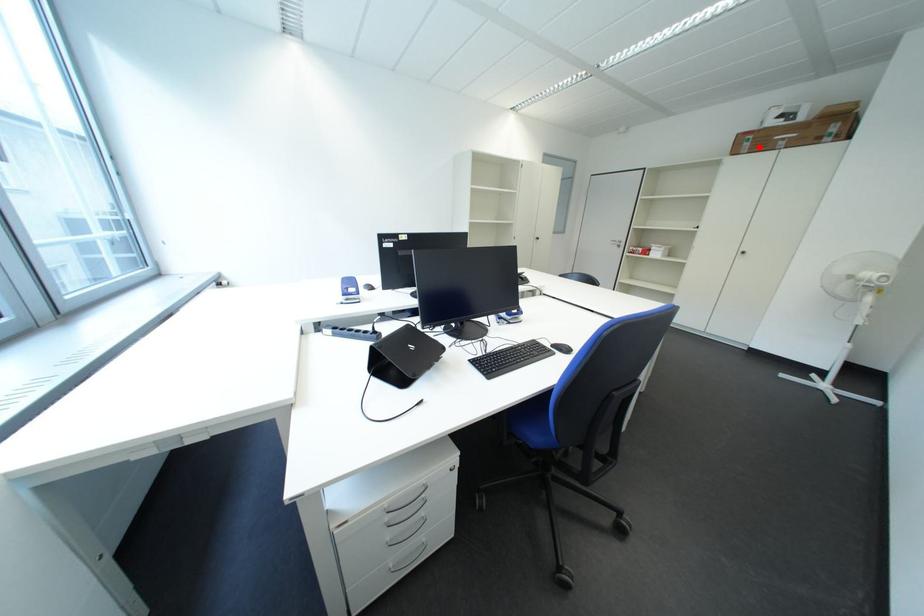
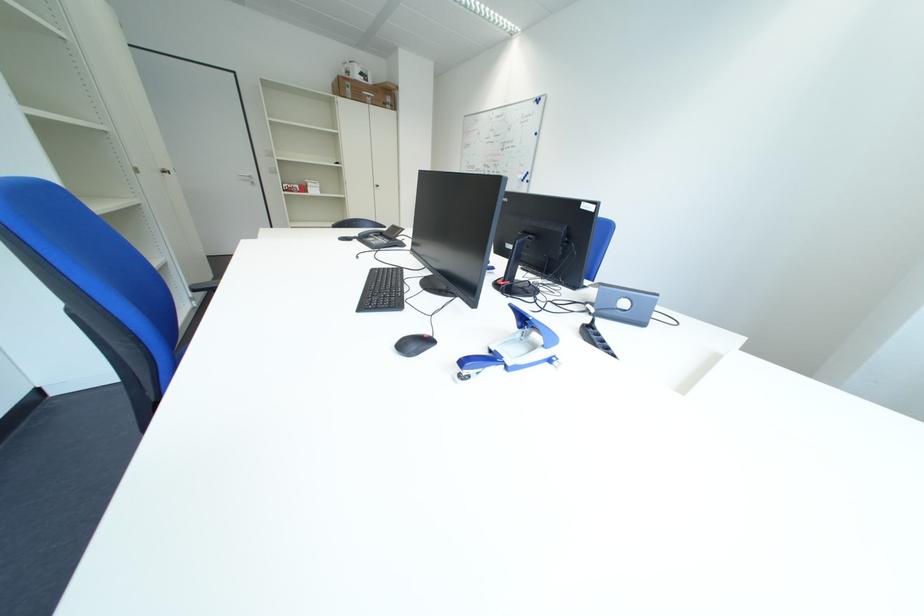
Locate, in the second image, the point that corresponds to the highlighted location in the first image.

(360, 92)